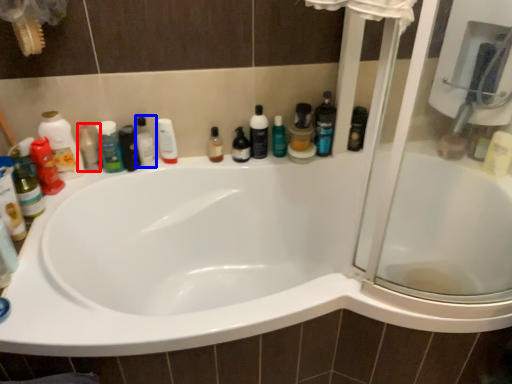
Question: Which object is closer to the camera taking this photo, toiletry (highlighted by a red box) or toiletry (highlighted by a blue box)?

Choices:
 (A) toiletry
 (B) toiletry

Answer: (A)